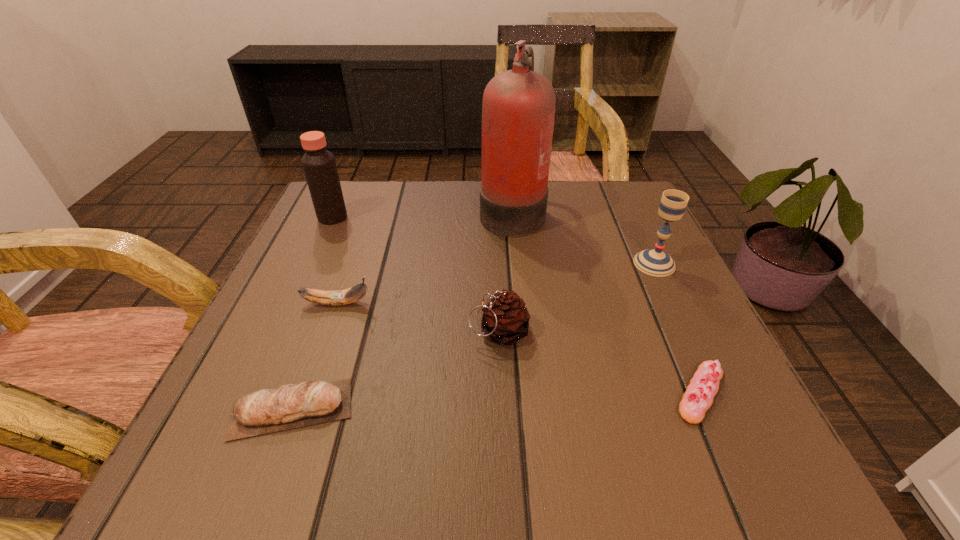
You are a GUI agent. You are given a task and a screenshot of the screen. Output one action in this format:
    pyautogui.click(x=<x>, y=<y>)
    Task: Click on the tallest object
    The image size is (960, 540).
    Given the screenshot: What is the action you would take?
    pyautogui.click(x=518, y=109)

In order to click on the second tallest object in this screenshot , I will do `click(319, 165)`.

I want to click on chalice, so click(x=655, y=262).

Where is `the third farthest object`? the third farthest object is located at coordinates (655, 262).

At what (x,y) coordinates should I click in order to perform the action: click on pinecone. Please return your answer as a coordinate pair (x, y). The image size is (960, 540). Looking at the image, I should click on (x=505, y=319).

Locate an element on the screen. The height and width of the screenshot is (540, 960). the fourth tallest object is located at coordinates (505, 319).

Identify the location of banana. (339, 297).

Find the location of a particular element. The image size is (960, 540). the fourth farthest object is located at coordinates [x=339, y=297].

Locate an element on the screen. pita bread is located at coordinates (290, 406).

Where is `the shortest object`? The image size is (960, 540). the shortest object is located at coordinates (698, 398).